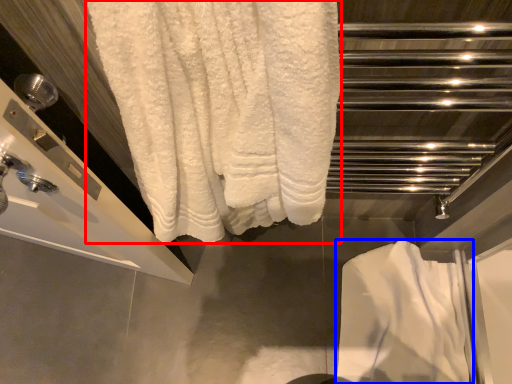
Question: Among these objects, which one is farthest to the camera, towel (highlighted by a red box) or bath towel (highlighted by a blue box)?

Choices:
 (A) towel
 (B) bath towel

Answer: (B)